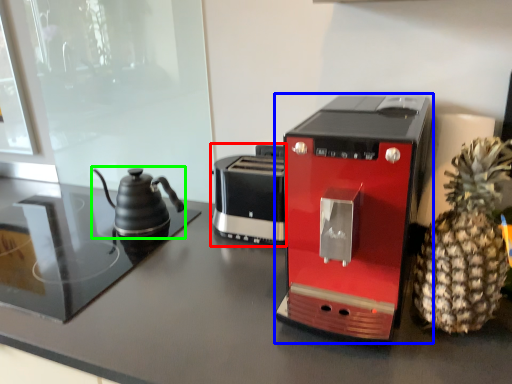
Question: Estimate the real-world distances between objects in this image. Which object is farther from toaster (highlighted by a red box), coffee maker (highlighted by a blue box) or kettle (highlighted by a green box)?

Choices:
 (A) coffee maker
 (B) kettle

Answer: (A)